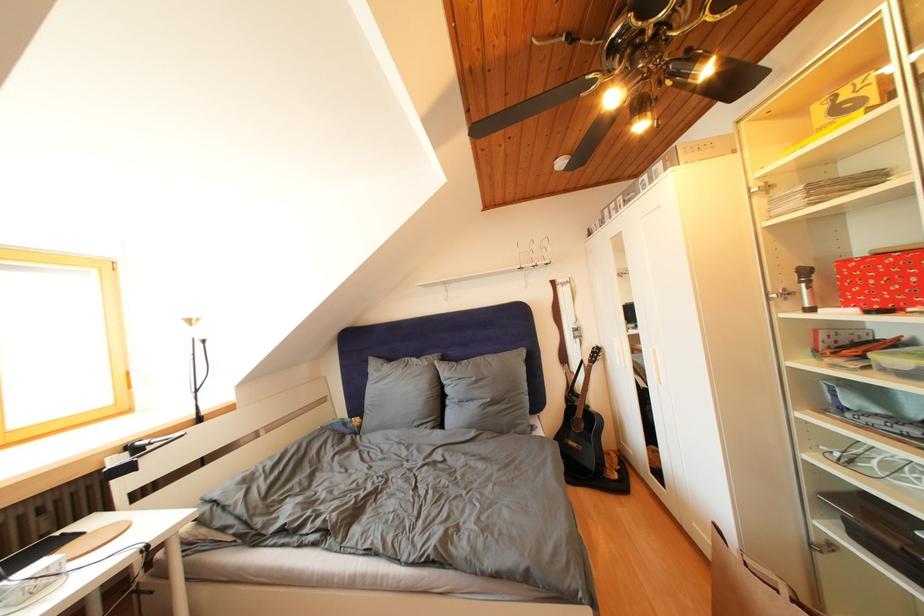
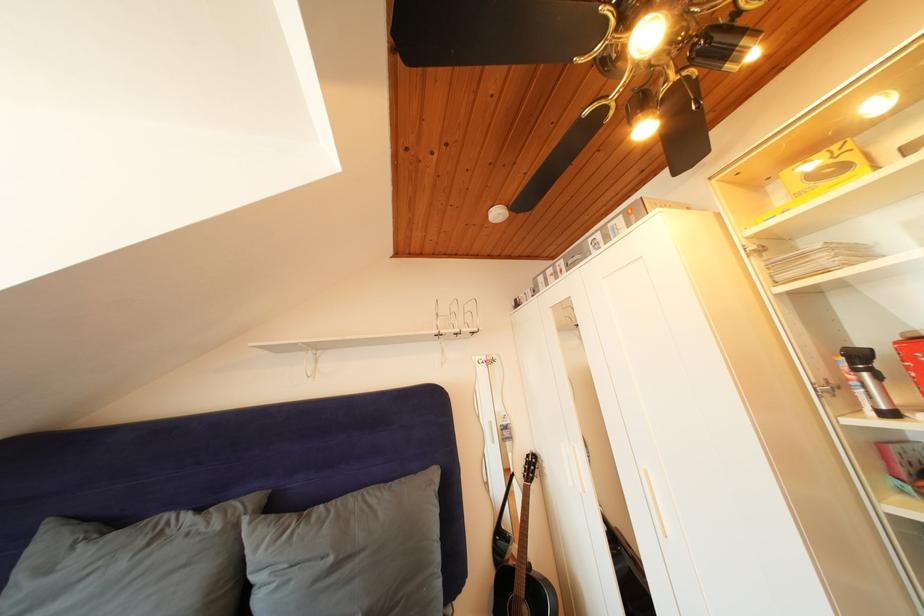
In the second image, find the point that corresponds to (860,100) in the first image.

(841, 167)